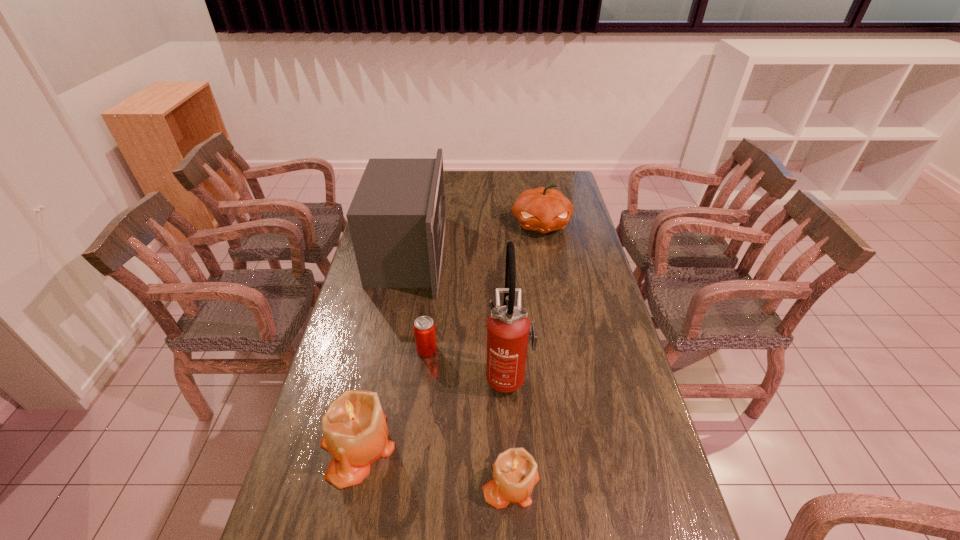
Find the location of a particular element. free point at the right edge is located at coordinates (578, 291).

This screenshot has height=540, width=960. In order to click on vacant space at the near right corner in this screenshot , I will do `click(669, 509)`.

This screenshot has width=960, height=540. Identify the location of empty space that is in between the can and the taller candle. (393, 398).

What are the coordinates of `empty location between the pumpkin and the can` in the screenshot? It's located at (484, 287).

You are a GUI agent. You are given a task and a screenshot of the screen. Output one action in this format:
    pyautogui.click(x=<x>, y=<y>)
    Task: Click on the free space between the taller candle and the microwave oven
    
    Given the screenshot: What is the action you would take?
    pyautogui.click(x=383, y=350)

Locate an element on the screen. Image resolution: width=960 pixels, height=540 pixels. free space between the can and the right candle is located at coordinates (468, 416).

I want to click on unoccupied position between the taller candle and the can, so click(x=393, y=398).

Where is `empty space between the microwave oven and the right candle`? Image resolution: width=960 pixels, height=540 pixels. empty space between the microwave oven and the right candle is located at coordinates (460, 368).

I want to click on free area in between the left candle and the shorter candle, so click(x=434, y=464).

I want to click on free space between the fire extinguisher and the pumpkin, so click(524, 300).